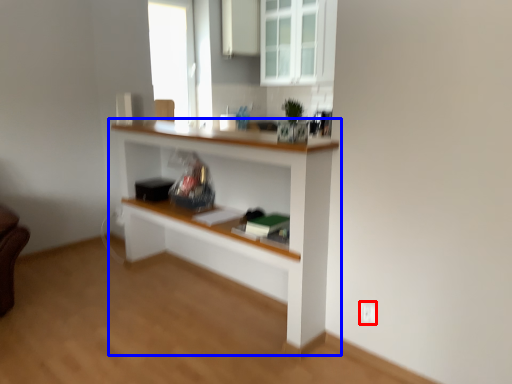
Question: Which object appears closest to the camera in this image, electric outlet (highlighted by a red box) or shelf (highlighted by a blue box)?

Choices:
 (A) electric outlet
 (B) shelf

Answer: (B)